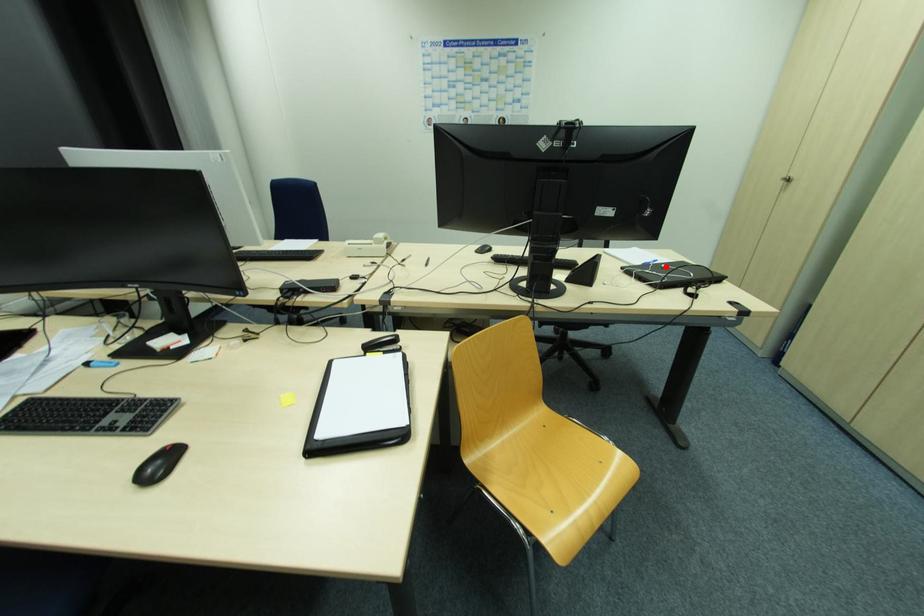
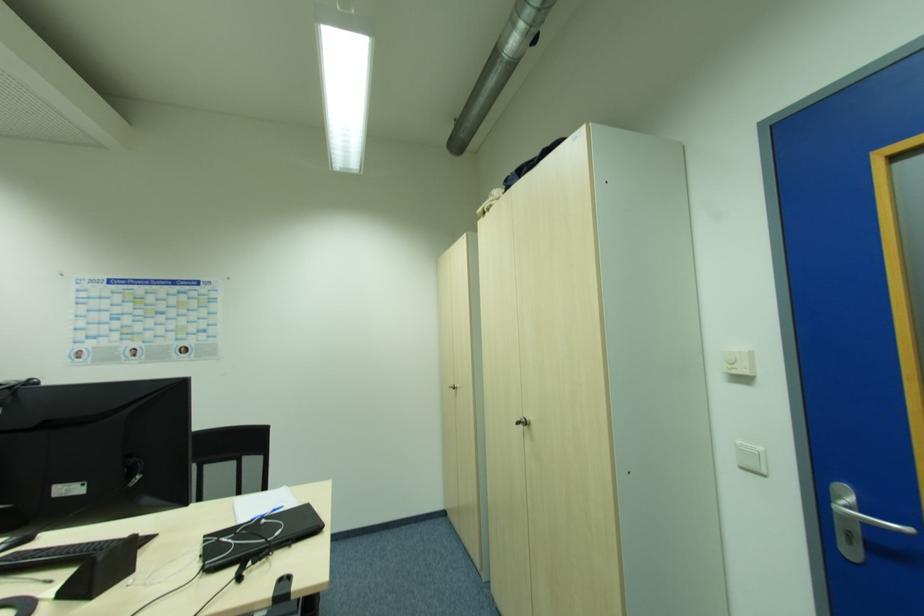
In the second image, find the point that corresponds to the highlighted location in the first image.

(265, 521)